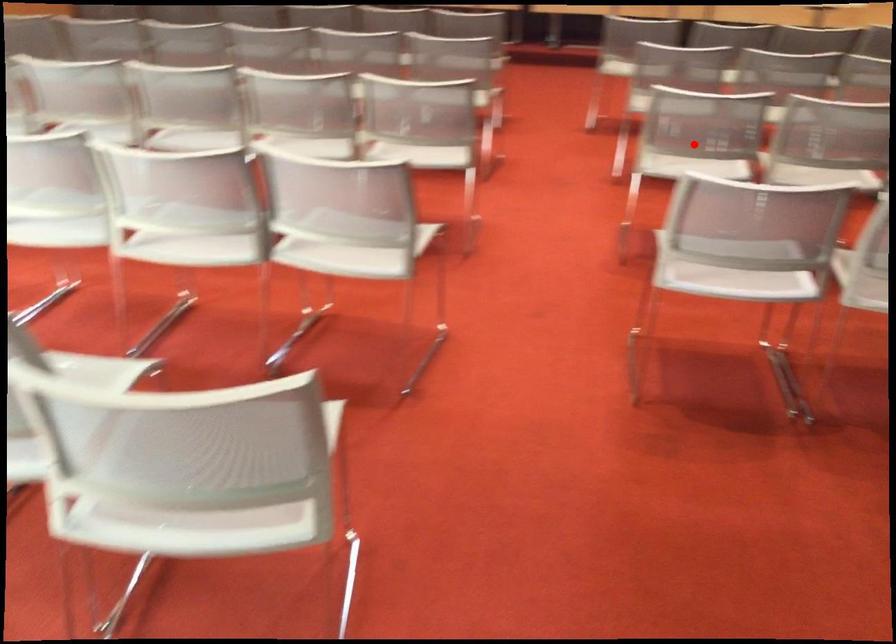
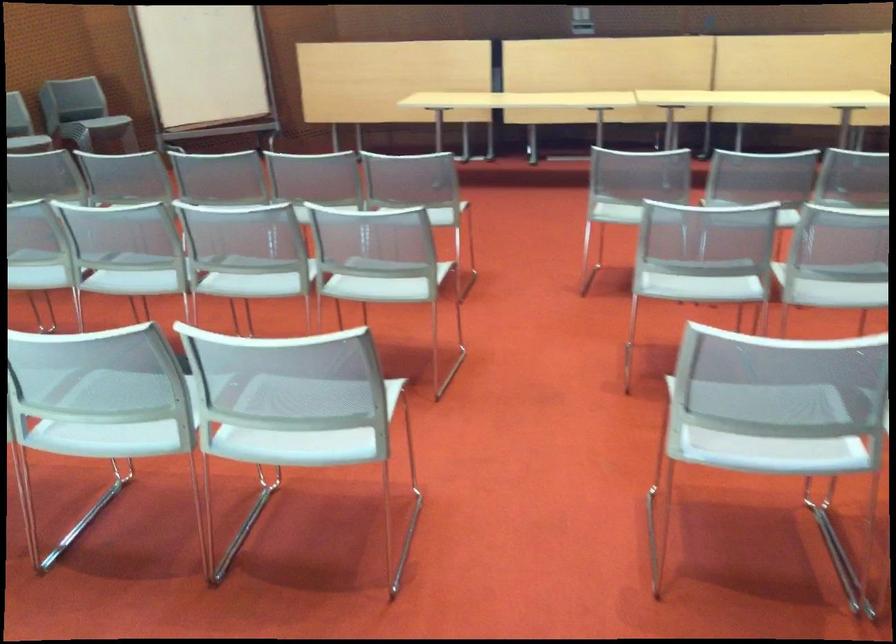
Where in the second image is the point corresponding to the highlighted location from the first image?

(772, 424)